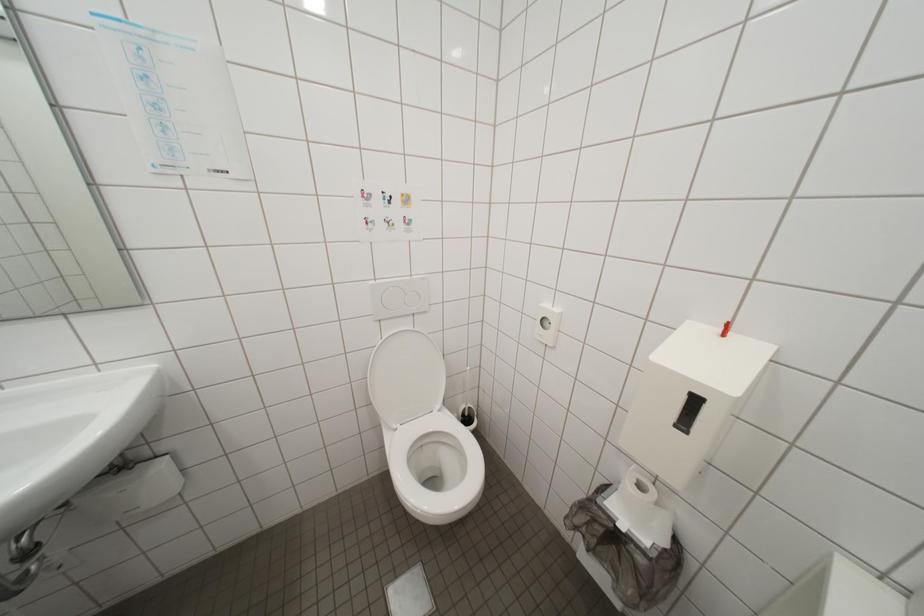
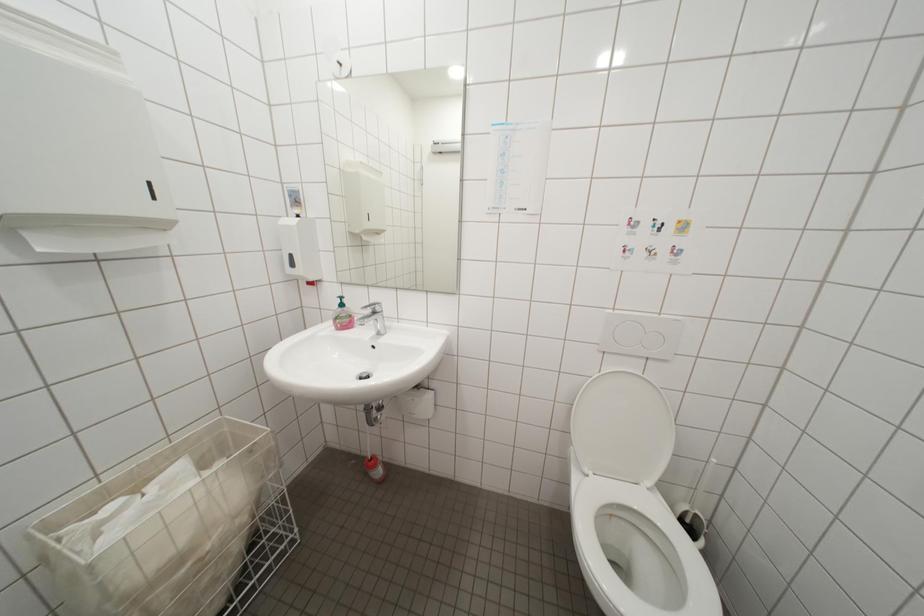
Question: The images are taken continuously from a first-person perspective. In which direction is your viewpoint rotating?

Choices:
 (A) Left
 (B) Right
 (C) Up
 (D) Down

Answer: (A)